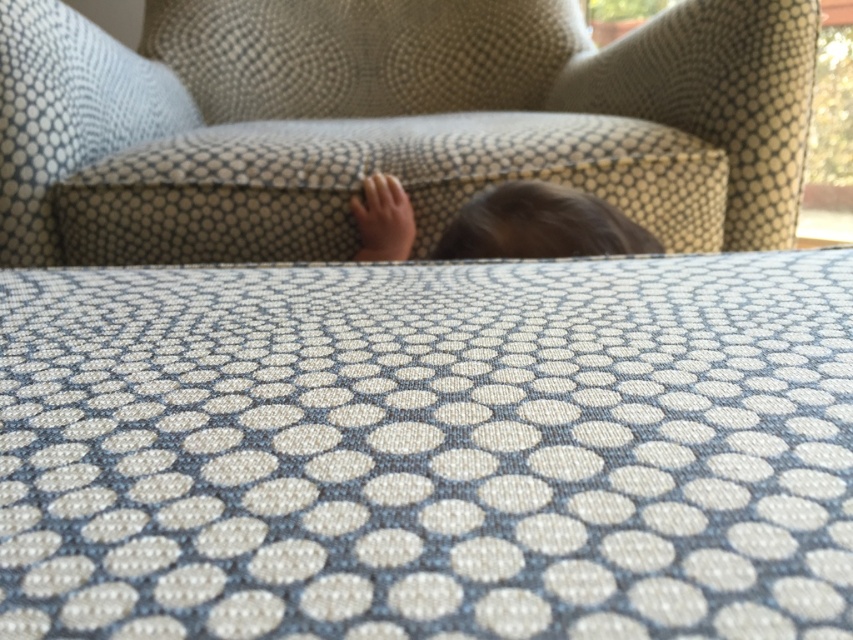
You are a photographer trying to capture a clear shot of the brown hair at center without the textured fabric armchair at center blocking it. How should you adjust your camera position?

To capture the brown hair at center without the textured fabric armchair at center blocking it, move your camera position further back so that the armchair is no longer in front of the hair.

Based on the scene, can you determine if the brown hair at center is wider than the matte skin hand at center?

The brown hair at center might be wider than matte skin hand at center according to the description.